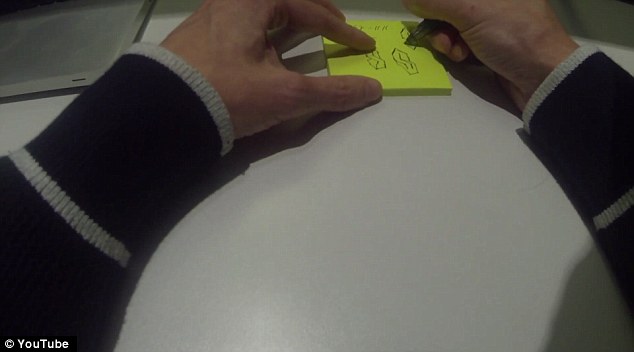
Image resolution: width=634 pixels, height=352 pixels. What are the coordinates of `desk` in the screenshot? It's located at (354, 250).